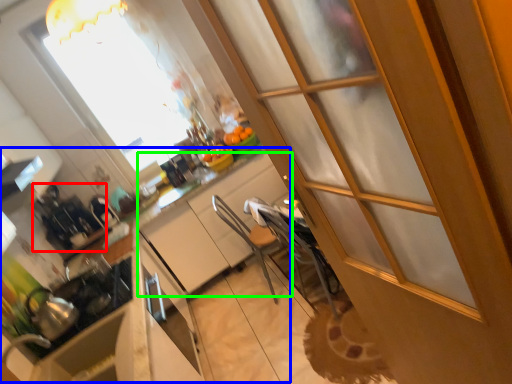
Question: Estimate the real-world distances between objects in this image. Which object is farther from appliance (highlighted by a red box), counter (highlighted by a blue box) or cabinetry (highlighted by a green box)?

Choices:
 (A) counter
 (B) cabinetry

Answer: (B)